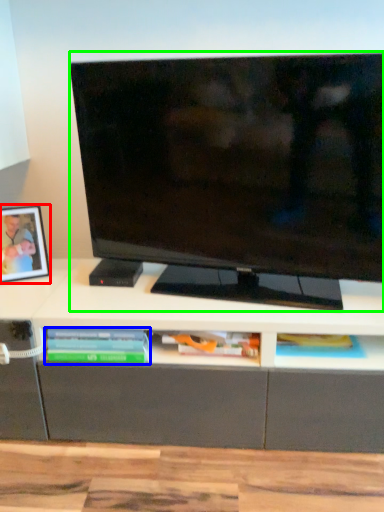
Question: Which object is positioned farthest from picture frame (highlighted by a red box)? Select from book (highlighted by a blue box) and television (highlighted by a green box).

Choices:
 (A) book
 (B) television

Answer: (B)